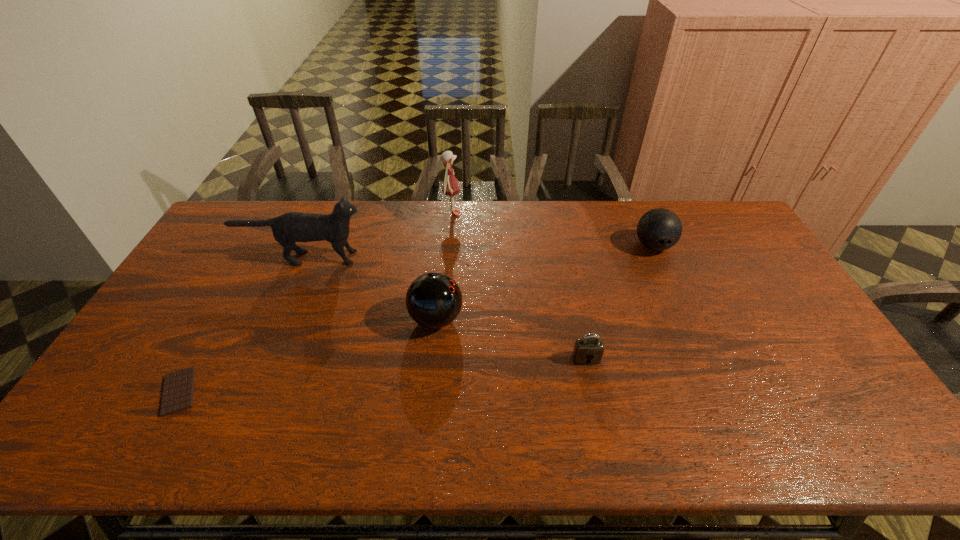
I want to click on free space located on the front-facing side of the farthest object, so click(542, 213).

Image resolution: width=960 pixels, height=540 pixels. In order to click on vacant space located 0.120m on the front-facing side of the cat in this screenshot , I will do `click(404, 258)`.

Locate an element on the screen. The width and height of the screenshot is (960, 540). vacant area situated 0.300m on the surface of the left bowling ball near the finger holes is located at coordinates (566, 319).

This screenshot has width=960, height=540. Find the location of `free space located 0.110m on the grip area of the right bowling ball`. free space located 0.110m on the grip area of the right bowling ball is located at coordinates (670, 283).

Image resolution: width=960 pixels, height=540 pixels. In order to click on vacant space located at the front of the fifth object from left to right near the keyhole in this screenshot , I will do `click(600, 422)`.

You are a GUI agent. You are given a task and a screenshot of the screen. Output one action in this format:
    pyautogui.click(x=<x>, y=<y>)
    Task: Click on the vacant space situated on the back of the nearest object
    The height and width of the screenshot is (540, 960).
    Given the screenshot: What is the action you would take?
    pyautogui.click(x=201, y=352)

Where is `doll that is at the far edge`? The image size is (960, 540). doll that is at the far edge is located at coordinates click(450, 187).

The width and height of the screenshot is (960, 540). Find the location of `bowling ball situated at the far edge`. bowling ball situated at the far edge is located at coordinates (659, 229).

The width and height of the screenshot is (960, 540). Identify the location of cat that is at the left edge. (291, 227).

Where is `chocolate bar at the left edge`? This screenshot has height=540, width=960. chocolate bar at the left edge is located at coordinates (178, 389).